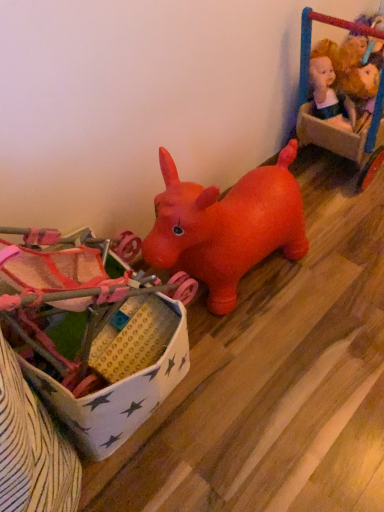
Question: Is the depth of plush yellow doll at upper right, which is the 2th toy from top to bottom, greater than that of velvet plush doll at upper right, the 3th toy ordered from the bottom?

Choices:
 (A) no
 (B) yes

Answer: (B)

Question: Is plush yellow doll at upper right, which is the 2th toy from top to bottom, not inside velvet plush doll at upper right, the 3th toy ordered from the bottom?

Choices:
 (A) yes
 (B) no

Answer: (B)

Question: Considering the relative sizes of plush yellow doll at upper right, placed as the second toy when sorted from bottom to top, and velvet plush doll at upper right, the 1th toy viewed from the top, in the image provided, is plush yellow doll at upper right, placed as the second toy when sorted from bottom to top, smaller than velvet plush doll at upper right, the 1th toy viewed from the top,?

Choices:
 (A) yes
 (B) no

Answer: (A)

Question: From the image's perspective, is plush yellow doll at upper right, which is the 2th toy from top to bottom, located beneath velvet plush doll at upper right, the 3th toy ordered from the bottom?

Choices:
 (A) yes
 (B) no

Answer: (A)

Question: Is velvet plush doll at upper right, the 3th toy ordered from the bottom, at the back of plush yellow doll at upper right, placed as the second toy when sorted from bottom to top?

Choices:
 (A) yes
 (B) no

Answer: (A)

Question: Which is correct: matte plastic toy at center, marked as the first toy in a left-to-right arrangement, is inside velvet plush doll at upper right, the third toy positioned from the left, or outside of it?

Choices:
 (A) outside
 (B) inside

Answer: (A)

Question: Is matte plastic toy at center, the 3th toy when ordered from top to bottom, to the left or to the right of velvet plush doll at upper right, the 3th toy ordered from the bottom, in the image?

Choices:
 (A) left
 (B) right

Answer: (A)

Question: Does point (119, 418) appear closer or farther from the camera than point (372, 150)?

Choices:
 (A) farther
 (B) closer

Answer: (B)

Question: Considering the positions of matte plastic toy at center, the third toy in the right-to-left sequence, and velvet plush doll at upper right, the 1th toy viewed from the top, in the image, is matte plastic toy at center, the third toy in the right-to-left sequence, taller or shorter than velvet plush doll at upper right, the 1th toy viewed from the top,?

Choices:
 (A) short
 (B) tall

Answer: (A)

Question: Is plush yellow doll at upper right, which is the 2th toy from top to bottom, in front of or behind matte plastic toy at center, marked as the first toy in a left-to-right arrangement, in the image?

Choices:
 (A) behind
 (B) front

Answer: (A)

Question: Is plush yellow doll at upper right, placed as the second toy when sorted from bottom to top, bigger or smaller than matte plastic toy at center, the third toy in the right-to-left sequence?

Choices:
 (A) big
 (B) small

Answer: (B)

Question: Is plush yellow doll at upper right, which ranks as the 2th toy in right-to-left order, taller or shorter than matte plastic toy at center, the third toy in the right-to-left sequence?

Choices:
 (A) short
 (B) tall

Answer: (A)

Question: Considering the positions of point (367, 80) and point (23, 367), is point (367, 80) closer or farther from the camera than point (23, 367)?

Choices:
 (A) farther
 (B) closer

Answer: (A)

Question: Looking at their shapes, would you say matte plastic toy at center, the third toy in the right-to-left sequence, is wider or thinner than plush yellow doll at upper right, which is the 2th toy from top to bottom?

Choices:
 (A) thin
 (B) wide

Answer: (B)

Question: From a real-world perspective, is matte plastic toy at center, the 3th toy when ordered from top to bottom, positioned above or below plush yellow doll at upper right, positioned as the 2th toy in left-to-right order?

Choices:
 (A) above
 (B) below

Answer: (B)